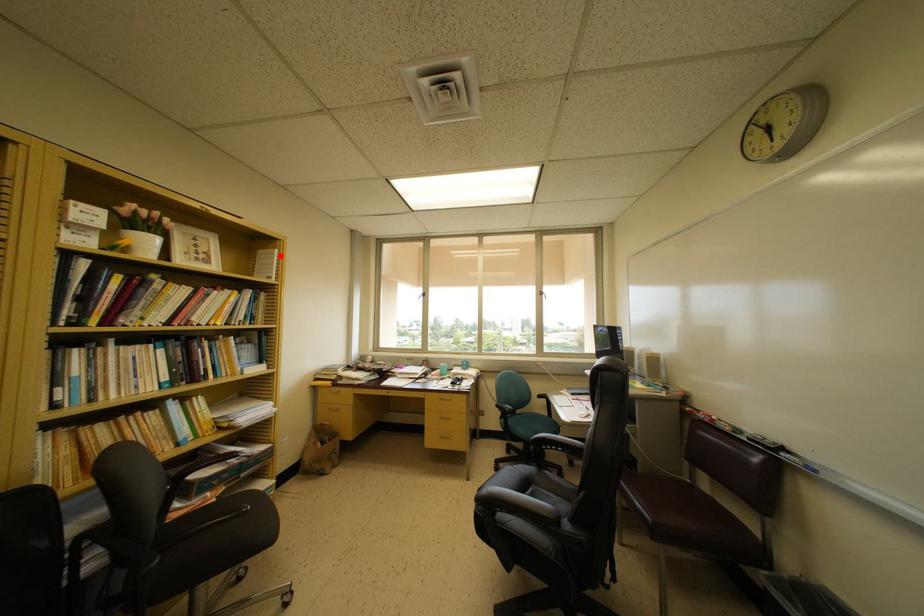
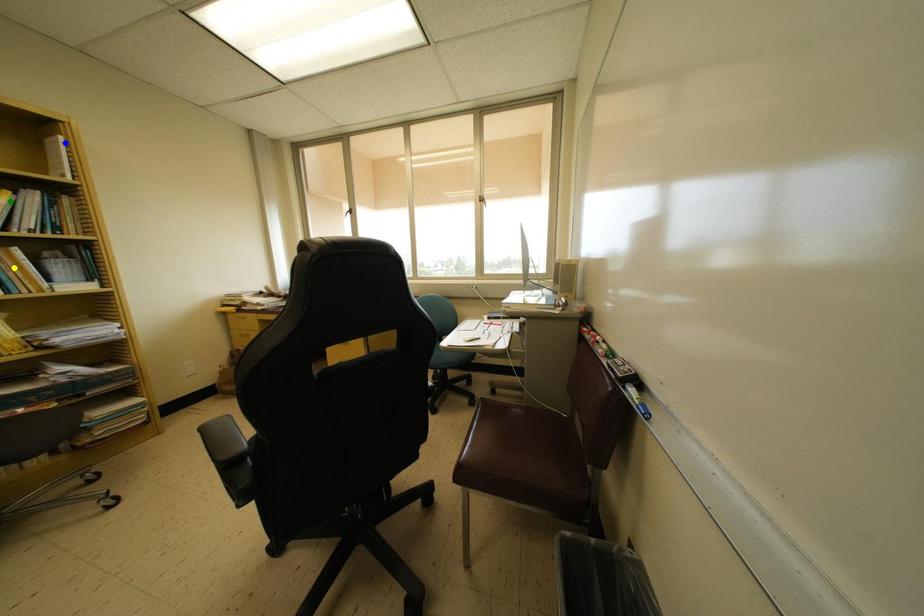
Question: I am providing you with two images of the same scene from different viewpoints. A red point is marked on the first image. You are given multiple points on the second image. Which spot in image 2 lines up with the point in image 1?

Choices:
 (A) green point
 (B) blue point
 (C) yellow point

Answer: (B)